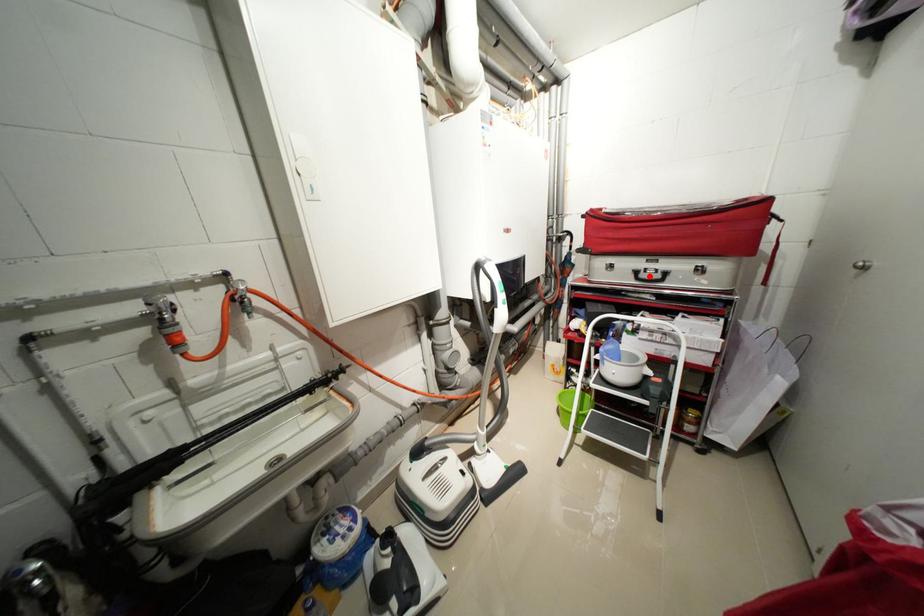
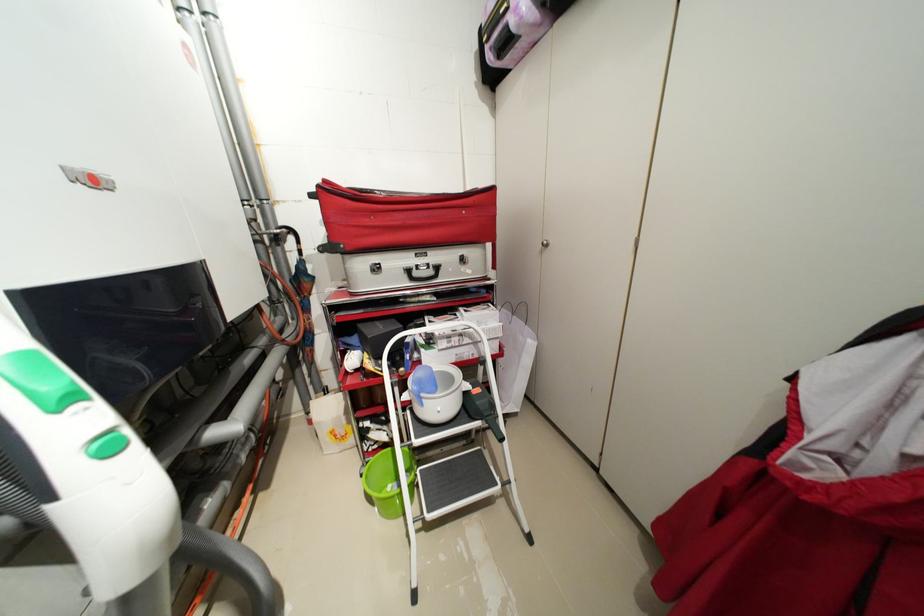
The point at the highlighted location is marked in the first image. Where is the corresponding point in the second image?

(422, 275)